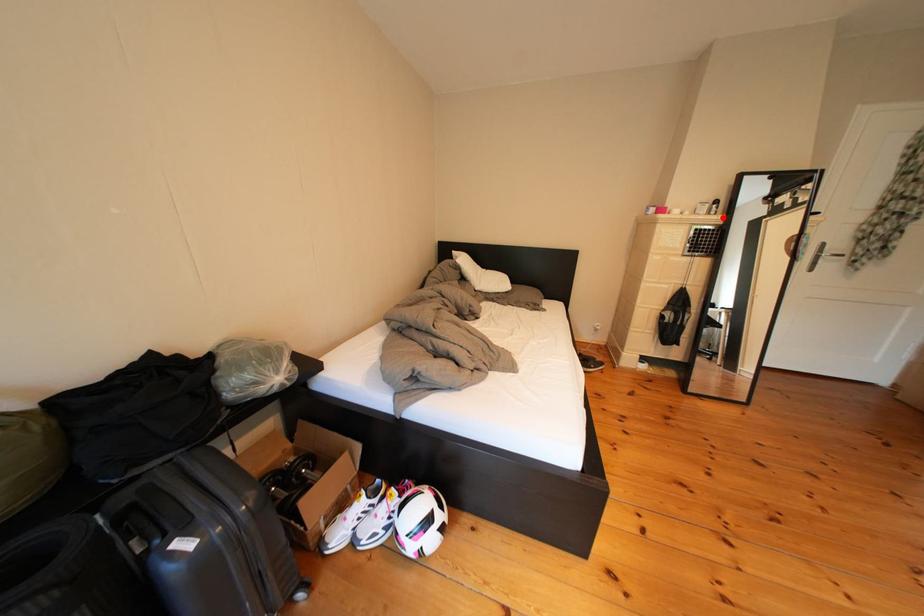
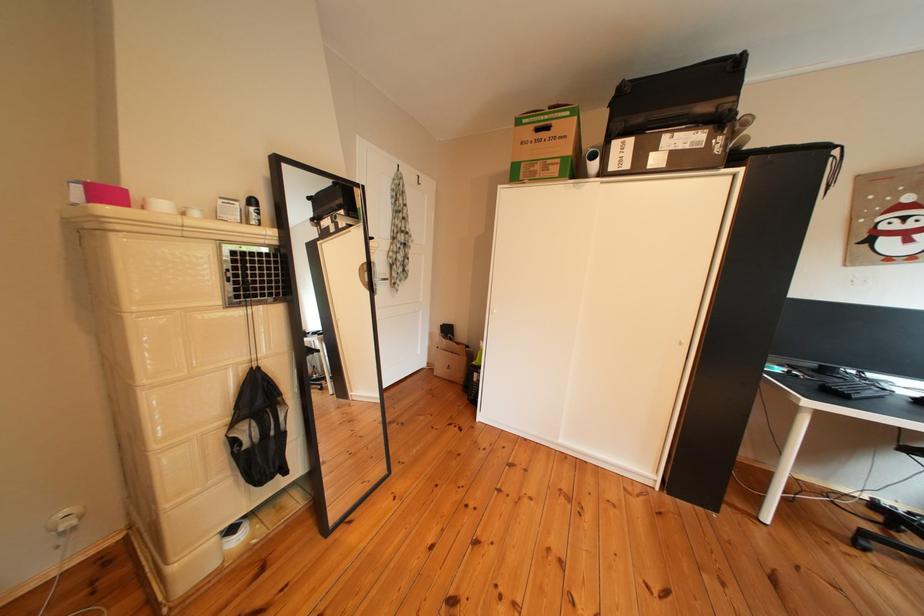
The point at the highlighted location is marked in the first image. Where is the corresponding point in the second image?

(259, 225)